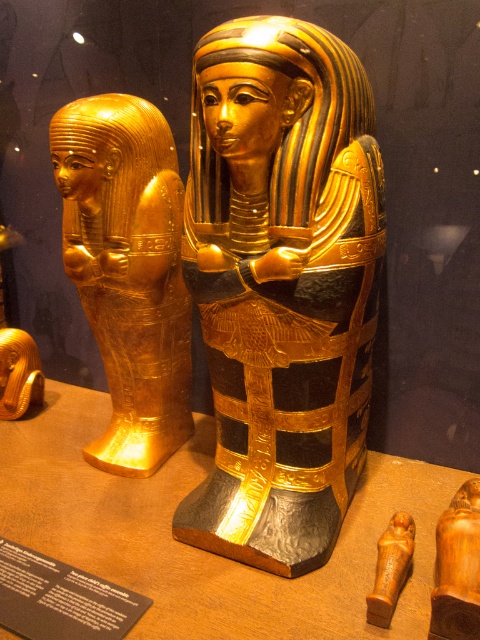
You are a museum curator planning to move the wooden statue at center to another exhibit. If you remove it from under the metallic gold table at center, will the table remain stable?

The metallic gold table at center is positioned over wooden statue at center. Removing the statue might destabilize the table since it was resting on the statue, so it is advisable to secure the table before moving the statue.

You are a museum curator who needs to place a 3.5 feet tall statue between the two sarcophagi displayed on the metallic gold table at center. Can the statue fit on the table without touching either sarcophagus?

The metallic gold table at center is 4.20 feet away from the camera, but the distance between the two sarcophagi isn not provided. Therefore, it is impossible to determine if the statue will fit without additional information.